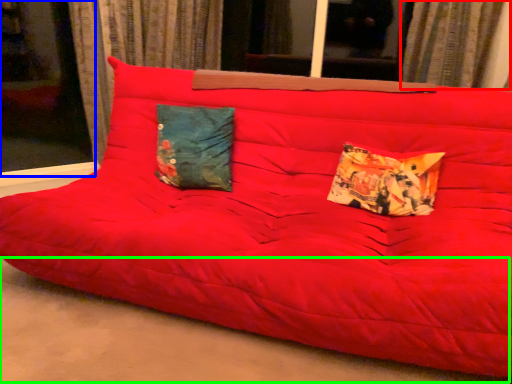
Question: Estimate the real-world distances between objects in this image. Which object is farther from curtain (highlighted by a red box), window (highlighted by a blue box) or concrete (highlighted by a green box)?

Choices:
 (A) window
 (B) concrete

Answer: (A)